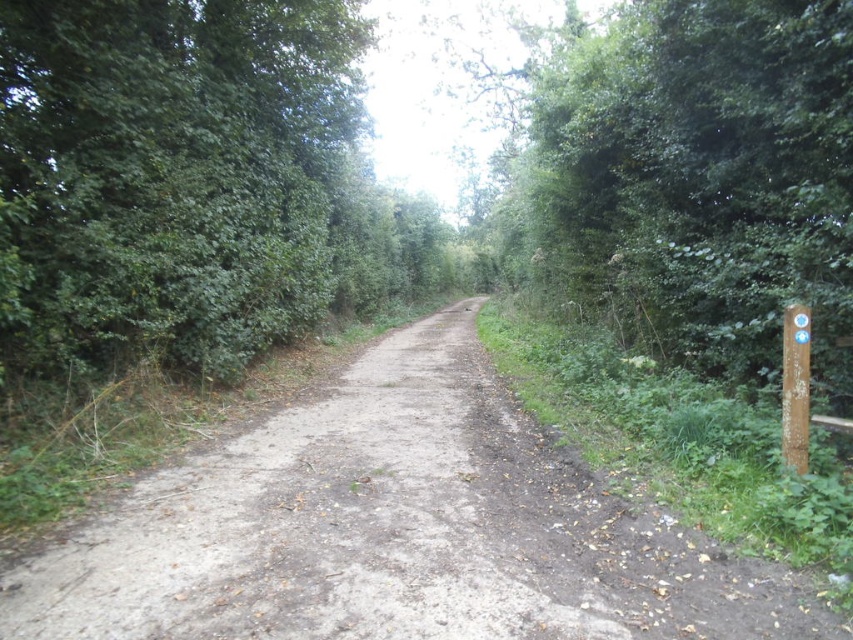
This screenshot has height=640, width=853. I want to click on dull brown dirt track at center, so click(x=397, y=531).

In the scene shown: Does dull brown dirt track at center appear over green leafy bush at left?

Actually, dull brown dirt track at center is below green leafy bush at left.

Is point (439, 435) closer to viewer compared to point (119, 17)?

Yes, it is in front of point (119, 17).

Where is `dull brown dirt track at center`? The width and height of the screenshot is (853, 640). dull brown dirt track at center is located at coordinates (397, 531).

Is dull brown dirt track at center closer to camera compared to green leafy tree at right?

That is True.

Does point (247, 621) come farther from viewer compared to point (715, 248)?

That is False.

You are a GUI agent. You are given a task and a screenshot of the screen. Output one action in this format:
    pyautogui.click(x=<x>, y=<y>)
    Task: Click on the dull brown dirt track at center
    The width and height of the screenshot is (853, 640).
    Given the screenshot: What is the action you would take?
    pyautogui.click(x=397, y=531)

Is point (91, 180) positioned in front of point (820, 352)?

No, (91, 180) is further to viewer.

Is point (320, 122) positioned before point (730, 275)?

No.

Where is `green leafy bush at left`? Image resolution: width=853 pixels, height=640 pixels. green leafy bush at left is located at coordinates (170, 173).